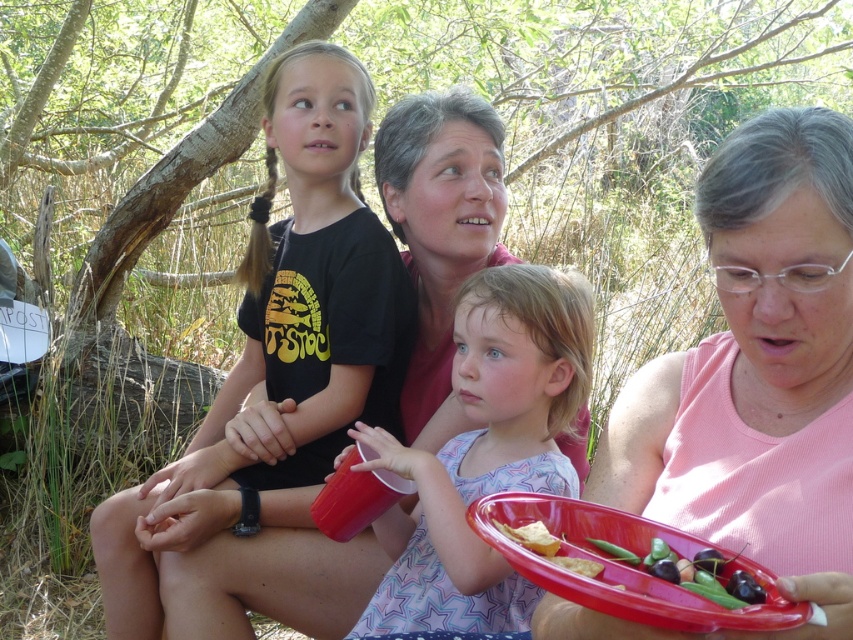
Looking at this image, you are standing at the origin point in the image and want to throw a paper airplane to reach the point at the bottom right corner of the image. Which of the two points, point (366, 93) or point (485, 419), is closer to your target?

Point (485, 419) is closer to the bottom right corner of the image than point (366, 93) because it is positioned further towards the bottom right direction.